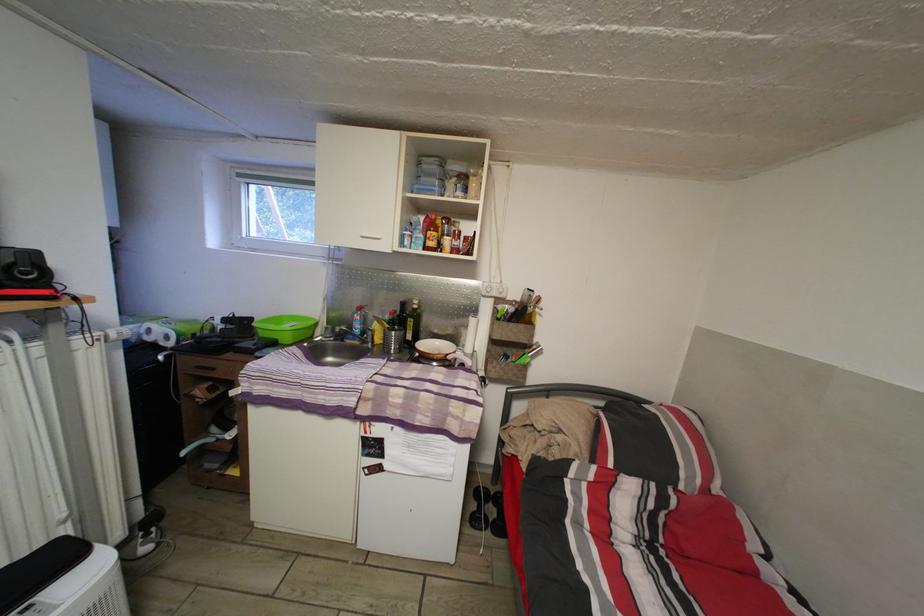
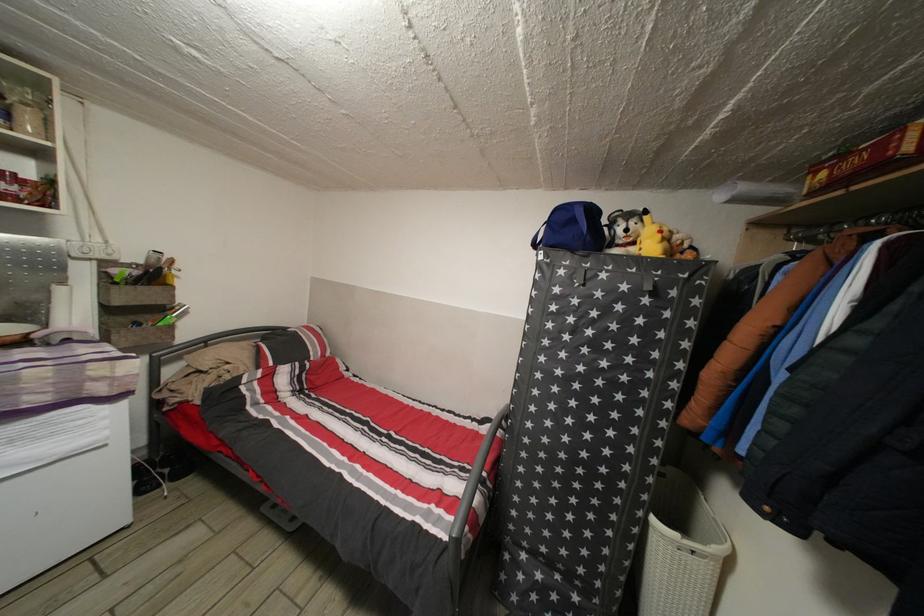
Question: The camera is either moving clockwise (left) or counter-clockwise (right) around the object. The first image is from the beginning of the video and the second image is from the end. Is the camera moving left or right when shooting the video?

Choices:
 (A) Left
 (B) Right

Answer: (A)